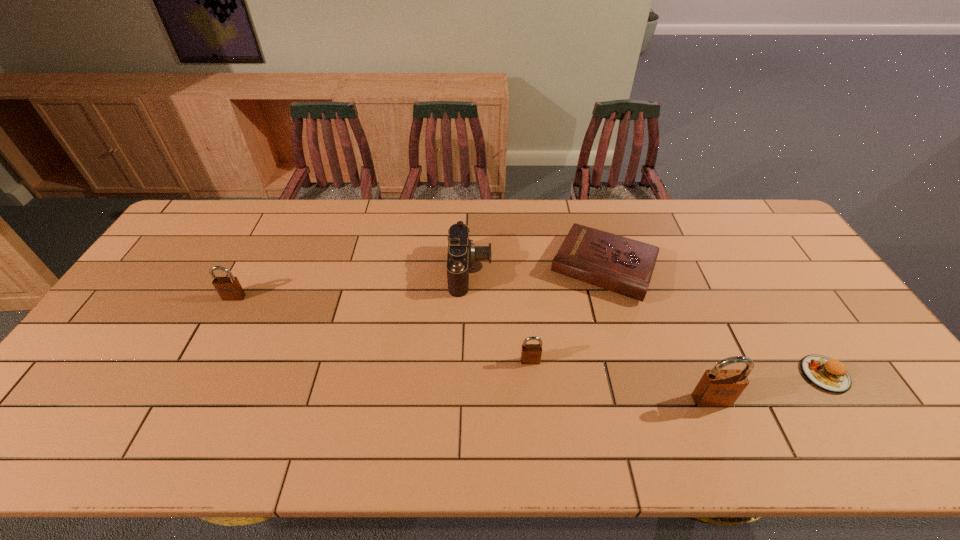
I want to click on free space located 0.310m on the front-facing side of the leftmost object, so click(181, 396).

Locate an element on the screen. free spot located on the front-facing side of the third object from left to right is located at coordinates (533, 389).

What are the coordinates of `blank area located on the front-facing side of the camera` in the screenshot? It's located at (611, 271).

Where is `free space located on the back of the patty`? free space located on the back of the patty is located at coordinates (782, 309).

Where is `free space located 0.340m on the right of the hardback book`? The height and width of the screenshot is (540, 960). free space located 0.340m on the right of the hardback book is located at coordinates (x=768, y=268).

The width and height of the screenshot is (960, 540). Find the location of `object that is positioned at the far edge`. object that is positioned at the far edge is located at coordinates pos(622,265).

Image resolution: width=960 pixels, height=540 pixels. I want to click on padlock that is at the near edge, so click(x=717, y=388).

This screenshot has width=960, height=540. What are the coordinates of `patty situated at the near edge` in the screenshot? It's located at (830, 375).

At what (x,y) coordinates should I click in order to perform the action: click on object at the right edge. Please return your answer as a coordinate pair (x, y). The image size is (960, 540). Looking at the image, I should click on (830, 375).

This screenshot has width=960, height=540. I want to click on object that is at the near right corner, so click(830, 375).